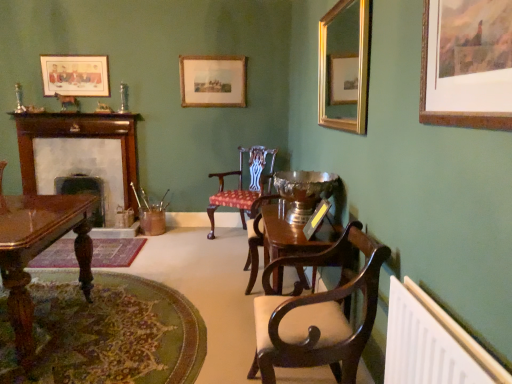
Question: Looking at their shapes, would you say white plastic radiator at lower right is wider or thinner than mahogany wood chair with upholstered seat at center, which ranks as the second chair in front-to-back order?

Choices:
 (A) thin
 (B) wide

Answer: (A)

Question: Based on their sizes in the image, would you say white plastic radiator at lower right is bigger or smaller than mahogany wood chair with upholstered seat at center, which ranks as the second chair in front-to-back order?

Choices:
 (A) big
 (B) small

Answer: (B)

Question: Based on their relative distances, which object is farther from the mahogany wood chair with upholstered seat at center, which appears as the 1th chair when viewed from the back?

Choices:
 (A) wooden picture frame at upper center, which is the 2th picture frame from left to right
 (B) white plastic radiator at lower right
 (C) wooden fireplace at left, acting as the 1th fireplace starting from the right
 (D) gold-framed mirror at upper right, arranged as the second picture frame when viewed from the right
 (E) dark wood fireplace at left, the second fireplace from the right

Answer: (B)

Question: Based on their relative distances, which object is farther from the mahogany wood chair at center, the first chair positioned from the front?

Choices:
 (A) white plastic radiator at lower right
 (B) gold-framed mirror at upper right, the 2th picture frame from the front
 (C) mahogany wood chair with upholstered seat at center, which ranks as the second chair in front-to-back order
 (D) gold-framed painting at upper right, marked as the 4th picture frame in a back-to-front arrangement
 (E) polished wood armchair at center

Answer: (C)